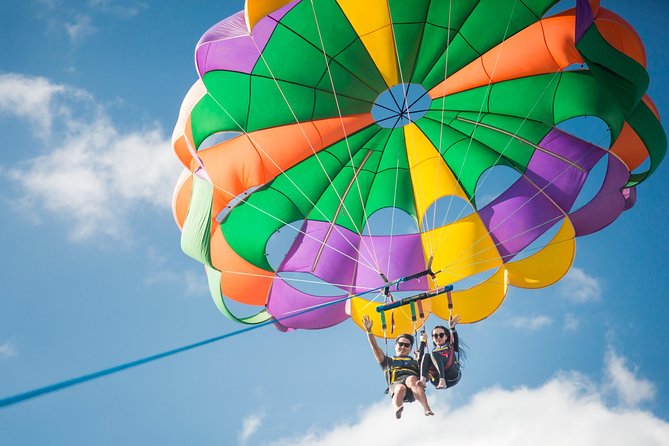
Find the location of a particular element. riser is located at coordinates (450, 306), (421, 311), (411, 311), (382, 319).